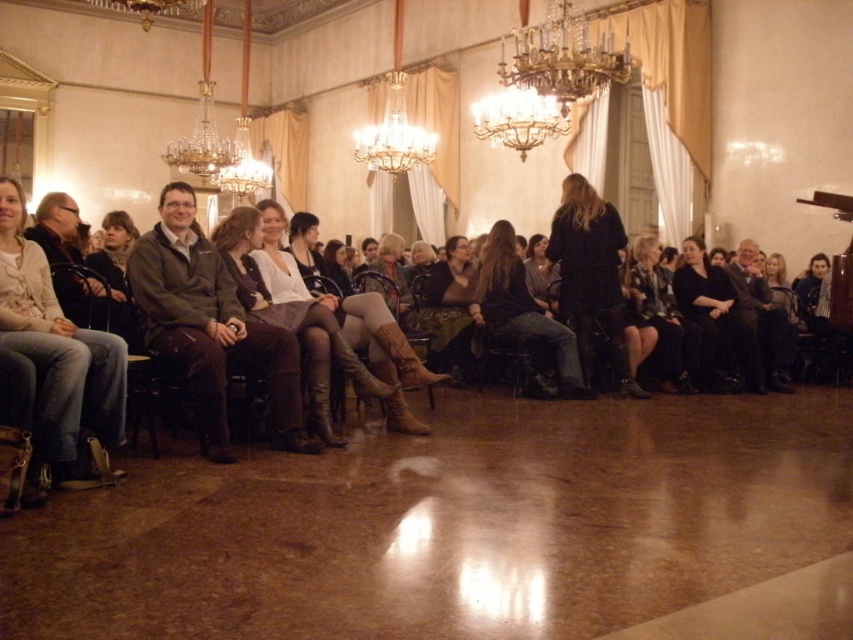
Question: Which object is positioned farthest from the denim jeans at center?

Choices:
 (A) gold metallic chandelier at upper center
 (B) green textured skirt at center
 (C) black velvet dress at right
 (D) jeans at left

Answer: (D)

Question: Estimate the real-world distances between objects in this image. Which object is closer to the leather at center?

Choices:
 (A) dark brown leather jacket at center
 (B) dark gray sweater at right
 (C) black leather jacket at center
 (D) denim jeans at center

Answer: (D)

Question: Does gold metallic chandelier at upper center have a larger size compared to green textured skirt at center?

Choices:
 (A) yes
 (B) no

Answer: (A)

Question: Which of these objects is positioned closest to the dark gray sweater at right?

Choices:
 (A) leather at center
 (B) jeans at left
 (C) green textured skirt at center
 (D) black leather jacket at center

Answer: (D)

Question: Can you confirm if jeans at left is positioned to the left of gold metallic chandelier at upper center?

Choices:
 (A) no
 (B) yes

Answer: (B)

Question: Is jeans at left bigger than dark gray sweater at right?

Choices:
 (A) no
 (B) yes

Answer: (A)